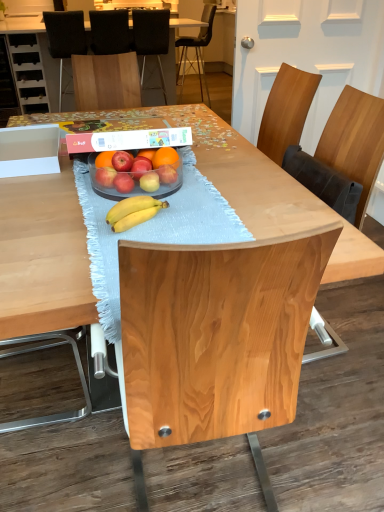
Question: Can you confirm if black leather chair at upper center, the fifth chair positioned from the front, is taller than matte red apple at center, which is the 3th apple from left to right?

Choices:
 (A) no
 (B) yes

Answer: (B)

Question: From the image's perspective, is black leather chair at upper center, acting as the first chair starting from the back, located beneath matte red apple at center, which is the 3th apple from left to right?

Choices:
 (A) yes
 (B) no

Answer: (B)

Question: Is black leather chair at upper center, acting as the first chair starting from the back, positioned with its back to matte red apple at center, the fourth apple when ordered from right to left?

Choices:
 (A) yes
 (B) no

Answer: (B)

Question: Can you confirm if black leather chair at upper center, the fifth chair positioned from the front, is bigger than matte red apple at center, the fourth apple when ordered from right to left?

Choices:
 (A) yes
 (B) no

Answer: (A)

Question: Is matte red apple at center, the fourth apple when ordered from right to left, surrounded by black leather chair at upper center, acting as the first chair starting from the back?

Choices:
 (A) yes
 (B) no

Answer: (B)

Question: In terms of width, does orangesmoothfruit at center look wider or thinner when compared to red matte apple at center, the fifth apple viewed from the right?

Choices:
 (A) wide
 (B) thin

Answer: (A)

Question: Is orangesmoothfruit at center taller or shorter than red matte apple at center, the fifth apple viewed from the right?

Choices:
 (A) tall
 (B) short

Answer: (A)

Question: Considering the positions of point (160, 163) and point (120, 170), is point (160, 163) closer or farther from the camera than point (120, 170)?

Choices:
 (A) closer
 (B) farther

Answer: (B)

Question: Considering the positions of orangesmoothfruit at center and red matte apple at center, the fifth apple viewed from the right, in the image, is orangesmoothfruit at center bigger or smaller than red matte apple at center, the fifth apple viewed from the right,?

Choices:
 (A) big
 (B) small

Answer: (A)

Question: From their relative heights in the image, would you say red matte apple at center, which is the second apple in left-to-right order, is taller or shorter than orangesmoothfruit at center?

Choices:
 (A) tall
 (B) short

Answer: (B)

Question: Does point (124, 163) appear closer or farther from the camera than point (157, 150)?

Choices:
 (A) farther
 (B) closer

Answer: (B)

Question: In terms of width, does red matte apple at center, the fifth apple viewed from the right, look wider or thinner when compared to orangesmoothfruit at center?

Choices:
 (A) wide
 (B) thin

Answer: (B)

Question: Which is correct: red matte apple at center, the fifth apple viewed from the right, is inside orangesmoothfruit at center, or outside of it?

Choices:
 (A) inside
 (B) outside

Answer: (B)

Question: In terms of width, does black fabric chair at upper left, positioned as the 2th chair in front-to-back order, look wider or thinner when compared to black fabric chair at upper center, which appears as the 3th chair when viewed from the back?

Choices:
 (A) wide
 (B) thin

Answer: (A)

Question: Considering the positions of black fabric chair at upper left, the fourth chair in the back-to-front sequence, and black fabric chair at upper center, which appears as the 3th chair when viewed from the back, in the image, is black fabric chair at upper left, the fourth chair in the back-to-front sequence, taller or shorter than black fabric chair at upper center, which appears as the 3th chair when viewed from the back,?

Choices:
 (A) short
 (B) tall

Answer: (B)